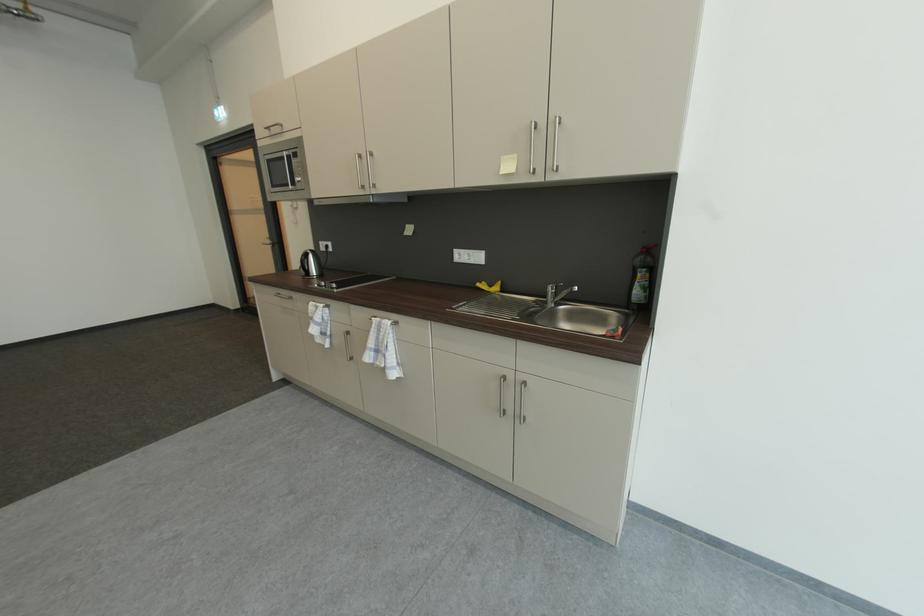
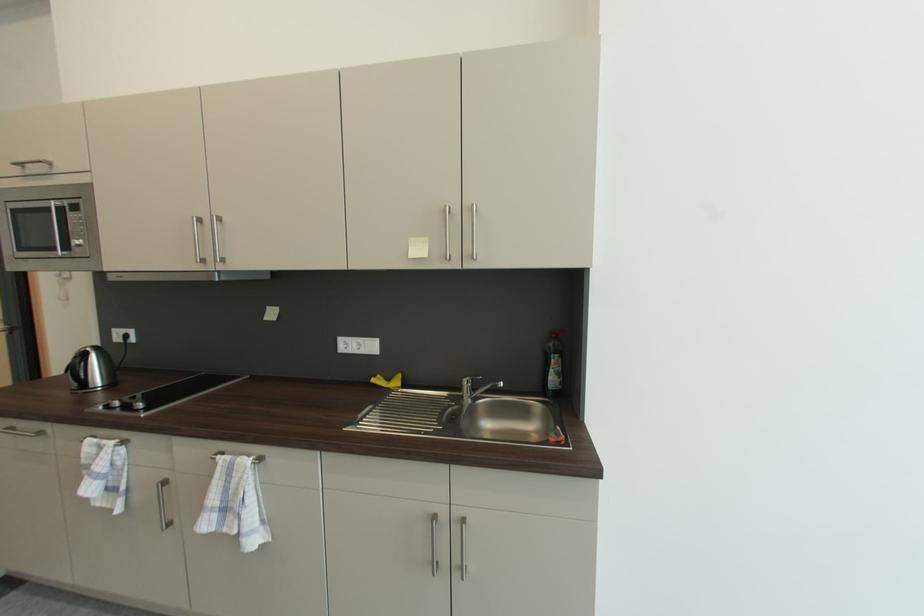
Question: The images are taken continuously from a first-person perspective. In which direction is your viewpoint rotating?

Choices:
 (A) Left
 (B) Right
 (C) Up
 (D) Down

Answer: (B)